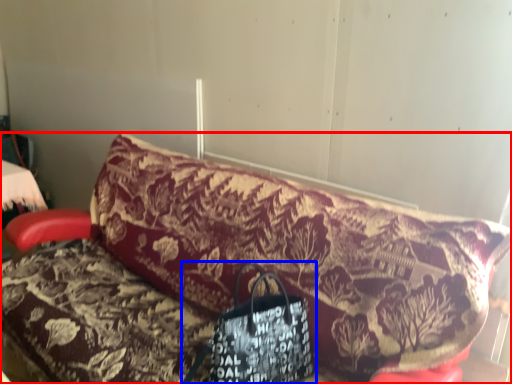
Question: Which object appears closest to the camera in this image, furniture (highlighted by a red box) or handbag (highlighted by a blue box)?

Choices:
 (A) furniture
 (B) handbag

Answer: (A)